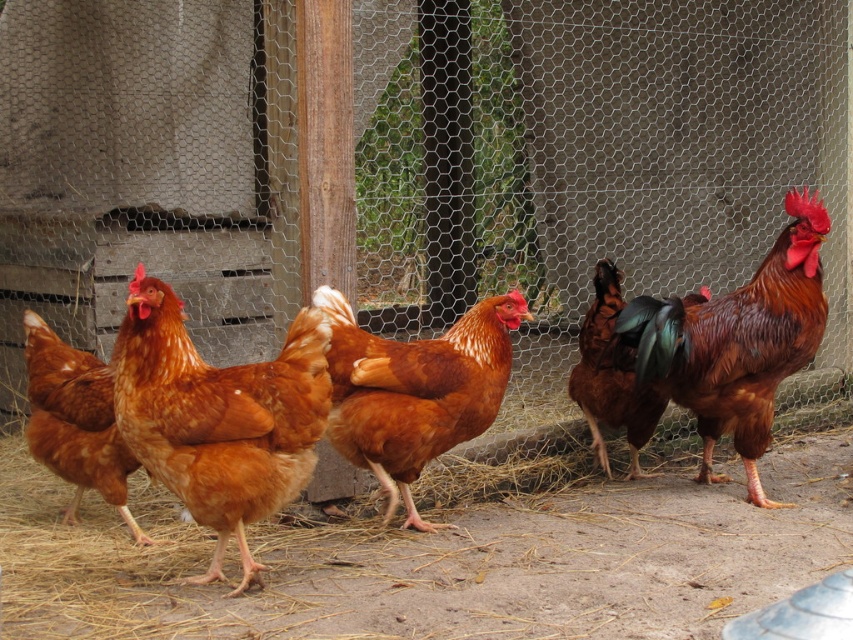
Is matte brown chicken at center in front of brown glossy chicken at center?

Yes, it is in front of brown glossy chicken at center.

Does matte brown chicken at center have a lesser width compared to brown glossy chicken at center?

No.

Does point (167, 328) come behind point (598, 324)?

No, it is in front of (598, 324).

Identify the location of matte brown chicken at center. The image size is (853, 640). (219, 417).

Does point (68, 406) come behind point (582, 401)?

No.

Between point (28, 324) and point (643, 404), which one is positioned in front?

Point (28, 324) is in front.

At what (x,y) coordinates should I click in order to perform the action: click on brown feathered chicken at left. Please return your answer as a coordinate pair (x, y). Looking at the image, I should click on (74, 420).

Measure the distance between matte brown chicken at center and camera.

A distance of 2.66 meters exists between matte brown chicken at center and camera.

Which is behind, point (160, 284) or point (451, 324)?

Positioned behind is point (451, 324).

Describe the element at coordinates (219, 417) in the screenshot. I see `matte brown chicken at center` at that location.

Image resolution: width=853 pixels, height=640 pixels. I want to click on matte brown chicken at center, so click(219, 417).